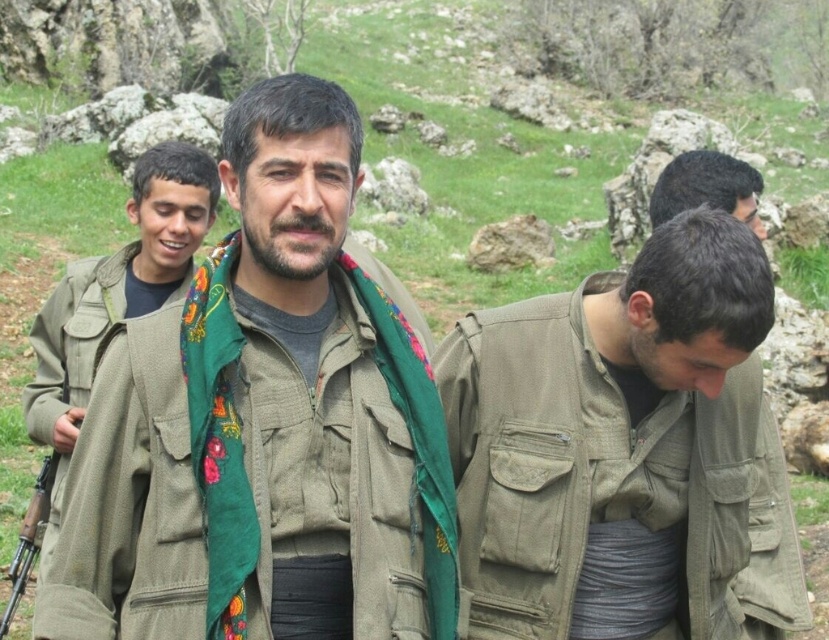
You are standing in front of the group of men and want to determine which of the two points, point (212, 266) or point (160, 252), is nearer to you. Based on the scene, which point is closer?

Point (212, 266) is closer to the viewer than point (160, 252).